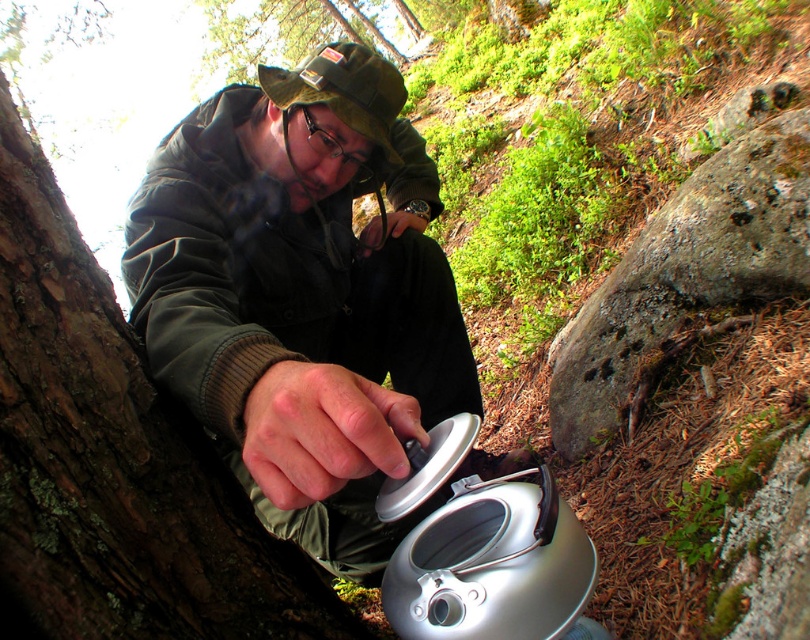
Does point (243, 136) lie in front of point (107, 422)?

No, it is not.

Is point (188, 115) farther from viewer compared to point (58, 554)?

That is True.

The width and height of the screenshot is (810, 640). What are the coordinates of `matte black jacket at center` in the screenshot? It's located at (301, 296).